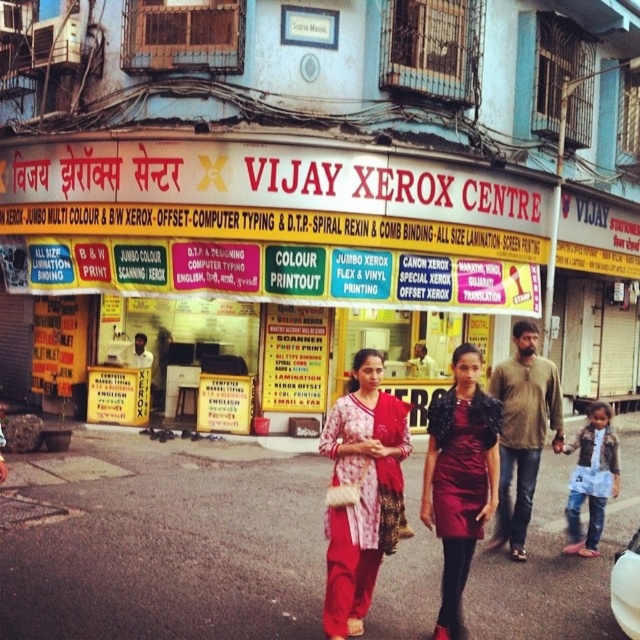
Does satin burgundy dress at center have a greater height compared to white shirt at center?

Correct, satin burgundy dress at center is much taller as white shirt at center.

Which of these two, satin burgundy dress at center or white shirt at center, stands shorter?

white shirt at center is shorter.

Image resolution: width=640 pixels, height=640 pixels. Describe the element at coordinates (460, 480) in the screenshot. I see `satin burgundy dress at center` at that location.

Locate an element on the screen. The height and width of the screenshot is (640, 640). satin burgundy dress at center is located at coordinates (460, 480).

What do you see at coordinates (362, 492) in the screenshot? I see `matte red dress at center` at bounding box center [362, 492].

Is point (388, 472) farther from camera compared to point (532, 396)?

No, it is not.

You are a GUI agent. You are given a task and a screenshot of the screen. Output one action in this format:
    pyautogui.click(x=<x>, y=<y>)
    Task: Click on the matte red dress at center
    The height and width of the screenshot is (640, 640).
    Given the screenshot: What is the action you would take?
    pyautogui.click(x=362, y=492)

Does yellow painted signboard at center have a smaller size compared to satin burgundy dress at center?

Incorrect, yellow painted signboard at center is not smaller in size than satin burgundy dress at center.

Who is more forward, (349, 236) or (465, 461)?

Positioned in front is point (465, 461).

Does point (80, 205) lie in front of point (452, 394)?

No, it is behind (452, 394).

Locate an element on the screen. yellow painted signboard at center is located at coordinates (269, 225).